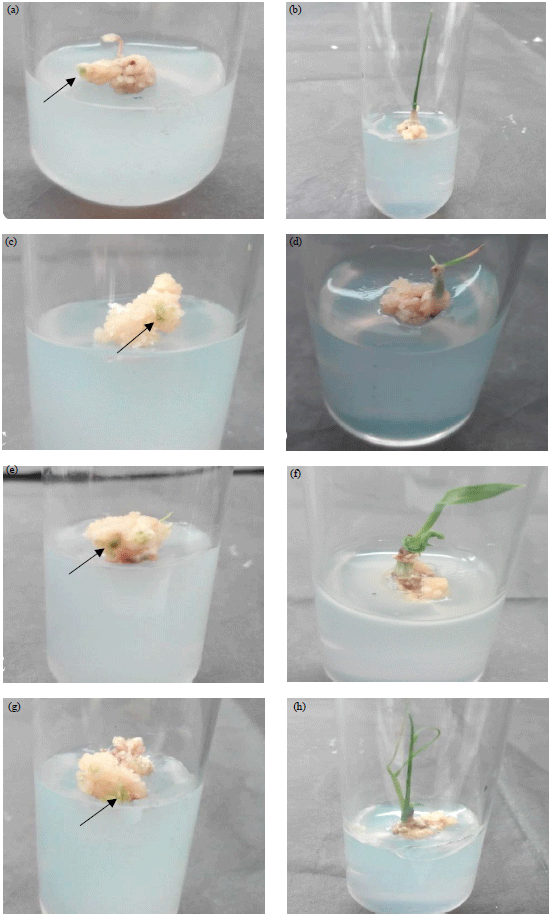
Find the location of `glass`. glass is located at coordinates (199, 22), (393, 38), (340, 266), (192, 264), (184, 485), (337, 496), (361, 736), (149, 728).